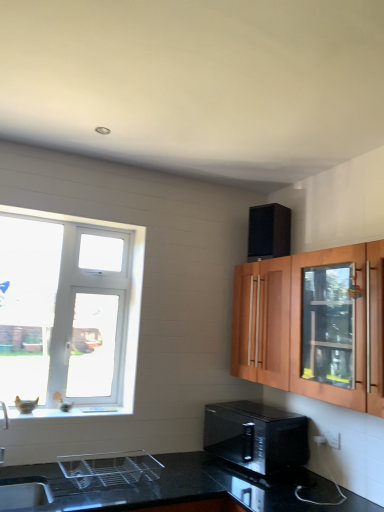
Question: From a real-world perspective, is white glossy window sill at lower left positioned above or below black textured speaker at upper right, the 1th appliance viewed from the back?

Choices:
 (A) below
 (B) above

Answer: (A)

Question: Is white glossy window sill at lower left situated inside black textured speaker at upper right, which is counted as the second appliance, starting from the bottom, or outside?

Choices:
 (A) inside
 (B) outside

Answer: (B)

Question: Which object is the closest to the white glossy window sill at lower left?

Choices:
 (A) wooden cabinet with glass door at upper right
 (B) clear glass dish rack at lower center, arranged as the second appliance when viewed from the back
 (C) black glossy microwave at lower center
 (D) black textured speaker at upper right, the first appliance positioned from the top
 (E) white plastic window at left

Answer: (B)

Question: Based on their relative distances, which object is nearer to the white glossy window sill at lower left?

Choices:
 (A) wooden cabinet with glass door at upper right
 (B) clear glass dish rack at lower center, which appears as the 2th appliance when viewed from the top
 (C) black textured speaker at upper right, the 2th appliance positioned from the front
 (D) black glossy microwave at lower center
 (E) white plastic window at left

Answer: (B)